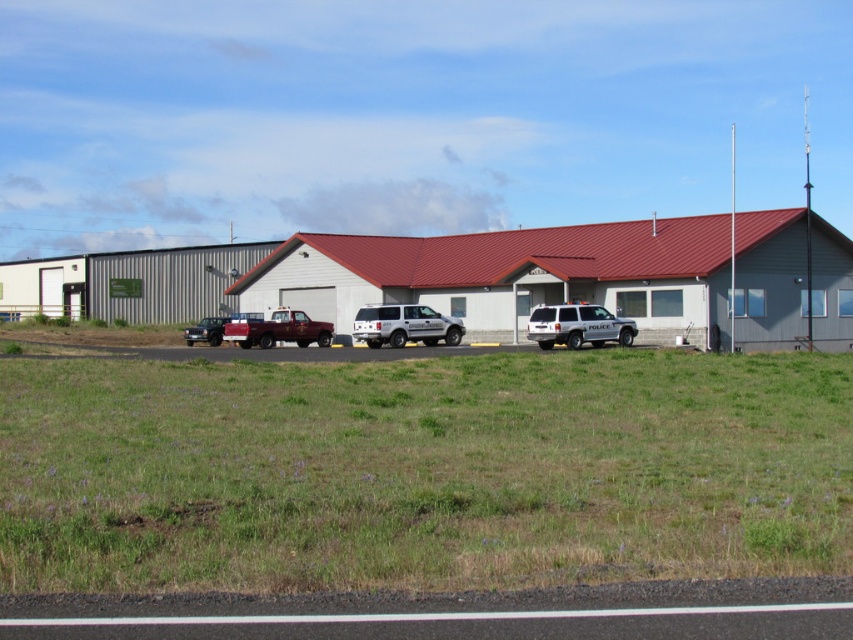
You are standing at the entrance of the main building and want to locate the silver metallic suv at center. According to the 2D coordinates provided, where would you find it relative to your position?

The silver metallic suv at center is located at coordinates point (404, 324), which means it is directly in front of you at the center of the parking area.

You are a delivery driver who needs to park your truck in the parking lot shown in the image. You see a silver metallic suv at center and a white matte police suv at center. Which vehicle takes up more space in the parking spot?

The white matte police suv at center is wider than the silver metallic suv at center, so it takes up more space in the parking spot.